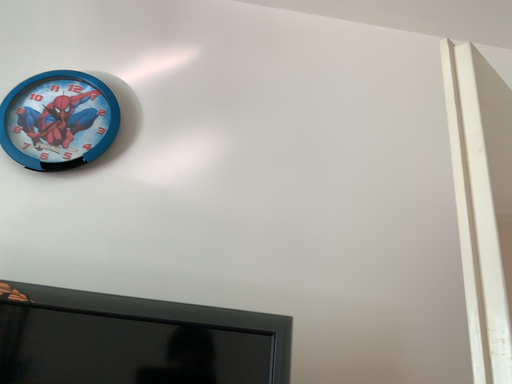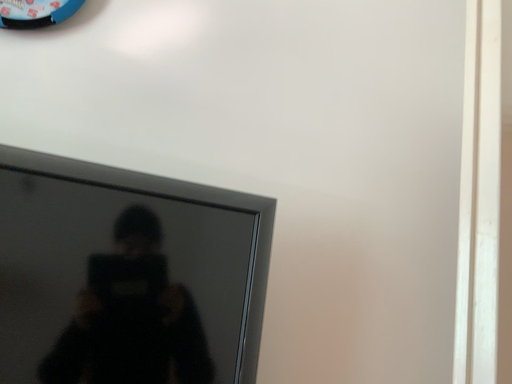
Question: How did the camera likely rotate when shooting the video?

Choices:
 (A) rotated downward
 (B) rotated upward

Answer: (A)